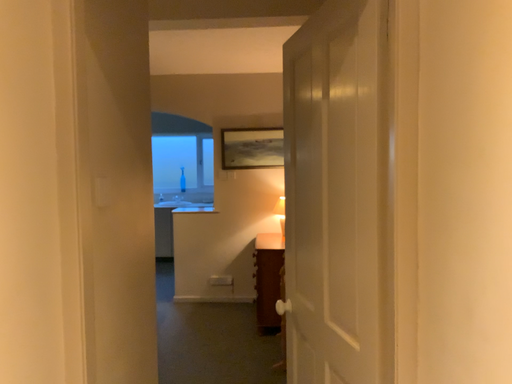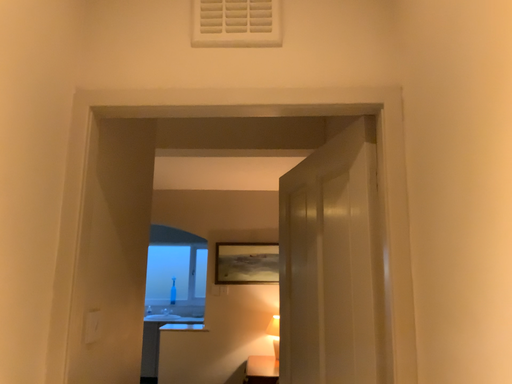
Question: Which way did the camera rotate in the video?

Choices:
 (A) rotated downward
 (B) rotated upward

Answer: (B)